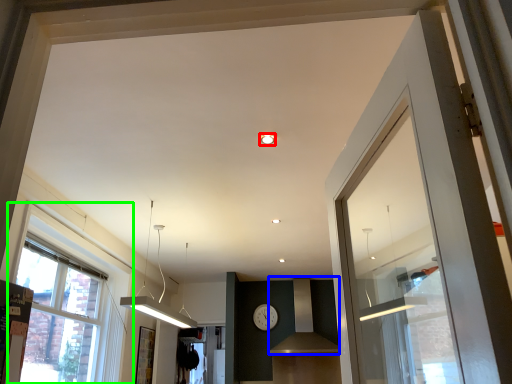
Question: Which is nearer to the lighting (highlighted by a red box)? vent (highlighted by a blue box) or window (highlighted by a green box).

Choices:
 (A) vent
 (B) window

Answer: (B)